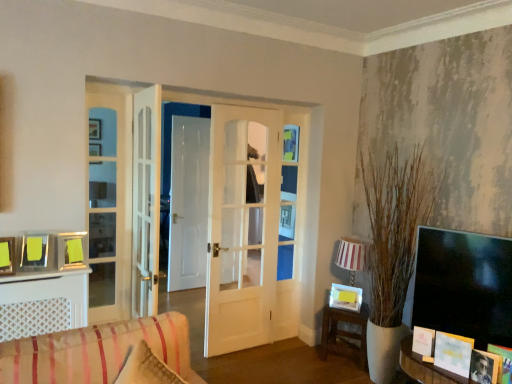
Measure the distance between point (13, 274) and camera.

The depth of point (13, 274) is 2.32 meters.

Image resolution: width=512 pixels, height=384 pixels. What do you see at coordinates (7, 256) in the screenshot?
I see `metallic silver picture frame at left, the sixth picture frame positioned from the right` at bounding box center [7, 256].

At what (x,y) coordinates should I click in order to perform the action: click on wooden picture frame at lower right, the first picture frame positioned from the right. Please return your answer as a coordinate pair (x, y). This screenshot has height=384, width=512. Looking at the image, I should click on (503, 362).

The image size is (512, 384). What do you see at coordinates (96, 351) in the screenshot?
I see `striped fabric sofa at lower left` at bounding box center [96, 351].

The image size is (512, 384). What are the coordinates of `white paper picture frame at lower right, the 3th picture frame from the bottom` in the screenshot? It's located at (423, 341).

Find the location of a particular element. This screenshot has width=512, height=384. wooden table at lower right is located at coordinates (344, 333).

Find the location of a particular element. This screenshot has width=512, height=384. metallic silver picture frame at left, placed as the 3th picture frame when sorted from front to back is located at coordinates (x=7, y=256).

Does point (36, 258) come closer to viewer compared to point (91, 163)?

Yes, it is in front of point (91, 163).

Does matte silver picture frame at left, which ranks as the 2th picture frame in top-to-bottom order, have a lesser height compared to matte silver picture frame at upper left, acting as the first picture frame starting from the left?

Correct, matte silver picture frame at left, which ranks as the 2th picture frame in top-to-bottom order, is not as tall as matte silver picture frame at upper left, acting as the first picture frame starting from the left.

Which of these two, matte silver picture frame at left, which ranks as the 2th picture frame in top-to-bottom order, or matte silver picture frame at upper left, acting as the first picture frame starting from the left, is bigger?

matte silver picture frame at upper left, acting as the first picture frame starting from the left.

Which object is more forward, matte silver picture frame at left, which appears as the 4th picture frame when viewed from the back, or matte silver picture frame at upper left, the first picture frame in the top-to-bottom sequence?

matte silver picture frame at left, which appears as the 4th picture frame when viewed from the back, is closer to the camera.

From a real-world perspective, who is located higher, white paper book at lower right or wooden table at lower right?

white paper book at lower right, from a real-world perspective.

Is point (451, 366) behind point (326, 353)?

No.

Is white paper book at lower right not close to wooden table at lower right?

Yes, white paper book at lower right is far from wooden table at lower right.

Locate an element on the screen. table that is on the left side of white paper book at lower right is located at coordinates (344, 333).

In order to click on the 2nd picture frame in front of the metallic silver picture frame at left, placed as the 3th picture frame when sorted from front to back, starting your count from the anchor in this screenshot , I will do coord(503,362).

Is wooden picture frame at lower right, marked as the first picture frame in a front-to-back arrangement, touching metallic silver picture frame at left, which appears as the fifth picture frame when ordered from the bottom?

There is a gap between wooden picture frame at lower right, marked as the first picture frame in a front-to-back arrangement, and metallic silver picture frame at left, which appears as the fifth picture frame when ordered from the bottom.

Is wooden picture frame at lower right, the seventh picture frame from the back, behind metallic silver picture frame at left, the sixth picture frame positioned from the right?

No, it is in front of metallic silver picture frame at left, the sixth picture frame positioned from the right.

Is point (504, 367) in front of point (0, 269)?

Yes, point (504, 367) is closer to viewer.

From their relative heights in the image, would you say matte silver picture frame at upper left, marked as the seventh picture frame in a front-to-back arrangement, is taller or shorter than white paper picture frame at lower right, the 3th picture frame from the bottom?

In the image, matte silver picture frame at upper left, marked as the seventh picture frame in a front-to-back arrangement, appears to be taller than white paper picture frame at lower right, the 3th picture frame from the bottom.

Is matte silver picture frame at upper left, which ranks as the first picture frame in back-to-front order, looking in the opposite direction of white paper picture frame at lower right, the third picture frame in the right-to-left sequence?

No, matte silver picture frame at upper left, which ranks as the first picture frame in back-to-front order, is not facing away from white paper picture frame at lower right, the third picture frame in the right-to-left sequence.

From a real-world perspective, which picture frame is the 5th one underneath the matte silver picture frame at upper left, marked as the seventh picture frame in a front-to-back arrangement? Please provide its 2D coordinates.

[(423, 341)]

Between white paper book at lower right and matte silver picture frame at left, arranged as the 3th picture frame when viewed from the left, which one appears on the right side from the viewer's perspective?

From the viewer's perspective, white paper book at lower right appears more on the right side.

Is the position of white paper book at lower right less distant than that of matte silver picture frame at left, which appears as the 4th picture frame when viewed from the back?

That is True.

Is white paper book at lower right oriented away from matte silver picture frame at left, which appears as the 4th picture frame when viewed from the back?

white paper book at lower right is not turned away from matte silver picture frame at left, which appears as the 4th picture frame when viewed from the back.

From the image's perspective, is white paper book at lower right located above or below matte silver picture frame at left, which appears as the 4th picture frame when viewed from the back?

white paper book at lower right is situated lower than matte silver picture frame at left, which appears as the 4th picture frame when viewed from the back, in the image.

Between matte black photo frame at lower right, which is the 6th picture frame from left to right, and matte silver picture frame at upper left, which ranks as the first picture frame in back-to-front order, which one has less height?

matte black photo frame at lower right, which is the 6th picture frame from left to right.

From the image's perspective, is matte black photo frame at lower right, positioned as the 2th picture frame in right-to-left order, located above matte silver picture frame at upper left, the first picture frame in the top-to-bottom sequence?

No.

From the image's perspective, starting from the matte silver picture frame at upper left, the seventh picture frame when ordered from bottom to top, which picture frame is the 6th one below? Please provide its 2D coordinates.

[(485, 367)]

How distant is matte black photo frame at lower right, the 2th picture frame from the front, from matte silver picture frame at upper left, acting as the first picture frame starting from the left?

2.54 meters.

Is wooden picture frame at lower right, the seventh picture frame from the back, at the left side of striped fabric sofa at lower left?

In fact, wooden picture frame at lower right, the seventh picture frame from the back, is to the right of striped fabric sofa at lower left.

Considering the positions of points (510, 353) and (186, 345), is point (510, 353) closer to camera compared to point (186, 345)?

No, (510, 353) is behind (186, 345).

Based on the photo, from the image's perspective, does wooden picture frame at lower right, the first picture frame positioned from the right, appear higher than striped fabric sofa at lower left?

Actually, wooden picture frame at lower right, the first picture frame positioned from the right, appears below striped fabric sofa at lower left in the image.

From a real-world perspective, does wooden picture frame at lower right, the seventh picture frame from the back, stand above striped fabric sofa at lower left?

No, from a real-world perspective, wooden picture frame at lower right, the seventh picture frame from the back, is not over striped fabric sofa at lower left

Find the location of a particular element. picture frame that appears above the matte silver picture frame at left, which appears as the 4th picture frame when viewed from the back (from the image's perspective) is located at coordinates (95, 149).

The image size is (512, 384). I want to click on table below the white paper book at lower right (from the image's perspective), so click(344, 333).

Based on their spatial positions, is wooden table at lower right or matte silver picture frame at left, which ranks as the 2th picture frame in top-to-bottom order, closer to matte black photo frame at lower right, positioned as the 2th picture frame in right-to-left order?

wooden table at lower right is closer to matte black photo frame at lower right, positioned as the 2th picture frame in right-to-left order.

Estimate the real-world distances between objects in this image. Which object is closer to wooden table at lower right, yellow paper at lower right, which appears as the fourth picture frame when ordered from the bottom, or metallic silver picture frame at left, placed as the 3th picture frame when sorted from front to back?

Among the two, yellow paper at lower right, which appears as the fourth picture frame when ordered from the bottom, is located nearer to wooden table at lower right.

Which object lies nearer to the anchor point wooden table at lower right, matte silver picture frame at left, acting as the 5th picture frame starting from the right, or wooden picture frame at lower right, arranged as the 2th picture frame when ordered from the bottom?

Among the two, wooden picture frame at lower right, arranged as the 2th picture frame when ordered from the bottom, is located nearer to wooden table at lower right.

From the image, which object appears to be nearer to matte silver picture frame at upper left, the first picture frame in the top-to-bottom sequence, wooden table at lower right or white paper book at lower right?

Based on the image, wooden table at lower right appears to be nearer to matte silver picture frame at upper left, the first picture frame in the top-to-bottom sequence.

Considering their positions, is metallic silver picture frame at left, placed as the 3th picture frame when sorted from front to back, positioned closer to white paper picture frame at lower right, the fifth picture frame in the left-to-right sequence, than white paper book at lower right?

white paper book at lower right lies closer to white paper picture frame at lower right, the fifth picture frame in the left-to-right sequence, than the other object.

When comparing their distances from wooden picture frame at lower right, arranged as the 2th picture frame when ordered from the bottom, does matte silver picture frame at left, which is counted as the sixth picture frame, starting from the bottom, or matte black photo frame at lower right, the 1th picture frame ordered from the bottom, seem further?

Based on the image, matte silver picture frame at left, which is counted as the sixth picture frame, starting from the bottom, appears to be further to wooden picture frame at lower right, arranged as the 2th picture frame when ordered from the bottom.

Based on their spatial positions, is matte black photo frame at lower right, positioned as the 2th picture frame in right-to-left order, or wooden picture frame at lower right, the sixth picture frame viewed from the top, closer to yellow paper at lower right, the 6th picture frame in the front-to-back sequence?

Among the two, matte black photo frame at lower right, positioned as the 2th picture frame in right-to-left order, is located nearer to yellow paper at lower right, the 6th picture frame in the front-to-back sequence.

Which object lies nearer to the anchor point white paper picture frame at lower right, which ranks as the fifth picture frame in top-to-bottom order, matte silver picture frame at upper left, which ranks as the first picture frame in back-to-front order, or metallic silver picture frame at left, the 3th picture frame when ordered from top to bottom?

matte silver picture frame at upper left, which ranks as the first picture frame in back-to-front order.

Find the location of a particular element. This screenshot has height=384, width=512. furniture between metallic silver picture frame at left, the 3th picture frame when ordered from top to bottom, and wooden picture frame at lower right, the seventh picture frame from the back, from left to right is located at coordinates (96, 351).

Identify the location of book located between wooden picture frame at lower right, marked as the first picture frame in a front-to-back arrangement, and wooden table at lower right in the depth direction. (453, 353).

Where is `book between striped fabric sofa at lower left and wooden picture frame at lower right, marked as the first picture frame in a front-to-back arrangement, in the horizontal direction`? book between striped fabric sofa at lower left and wooden picture frame at lower right, marked as the first picture frame in a front-to-back arrangement, in the horizontal direction is located at coordinates (453, 353).

Where is `table located between wooden picture frame at lower right, the sixth picture frame viewed from the top, and matte silver picture frame at upper left, the seventh picture frame when ordered from bottom to top, in the depth direction`? table located between wooden picture frame at lower right, the sixth picture frame viewed from the top, and matte silver picture frame at upper left, the seventh picture frame when ordered from bottom to top, in the depth direction is located at coordinates (344, 333).